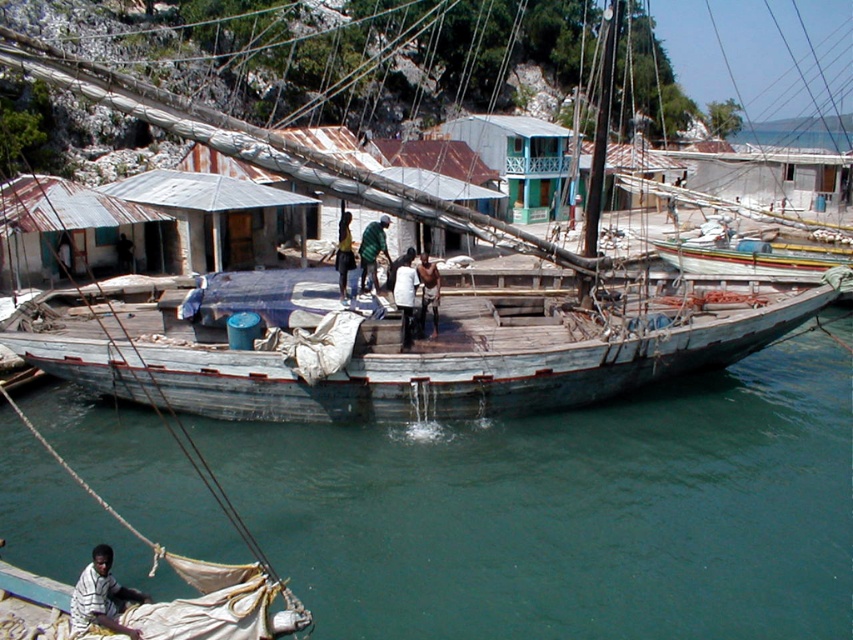
You are a photographer planning to capture a wide shot of the weathered wood boat at center and the dark brown leather jacket at center. Given the size difference between them, which object should you focus on to ensure both are clearly visible in the frame?

The weathered wood boat at center is larger in size than the dark brown leather jacket at center, so focusing on the boat will ensure both objects are clearly visible in the frame.

You are a photographer positioned on the dock, aiming to capture a clear shot of the green fabric shirt at center and the dark brown leather jacket at center. Based on their positions, which clothing item is closer to your camera?

The green fabric shirt at center is located above the dark brown leather jacket at center, so it is closer to the camera.